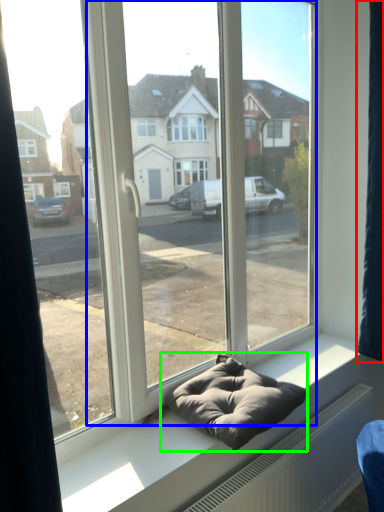
Question: Estimate the real-world distances between objects in this image. Which object is farther from curtain (highlighted by a red box), glass door (highlighted by a blue box) or bean bag chair (highlighted by a green box)?

Choices:
 (A) glass door
 (B) bean bag chair

Answer: (B)